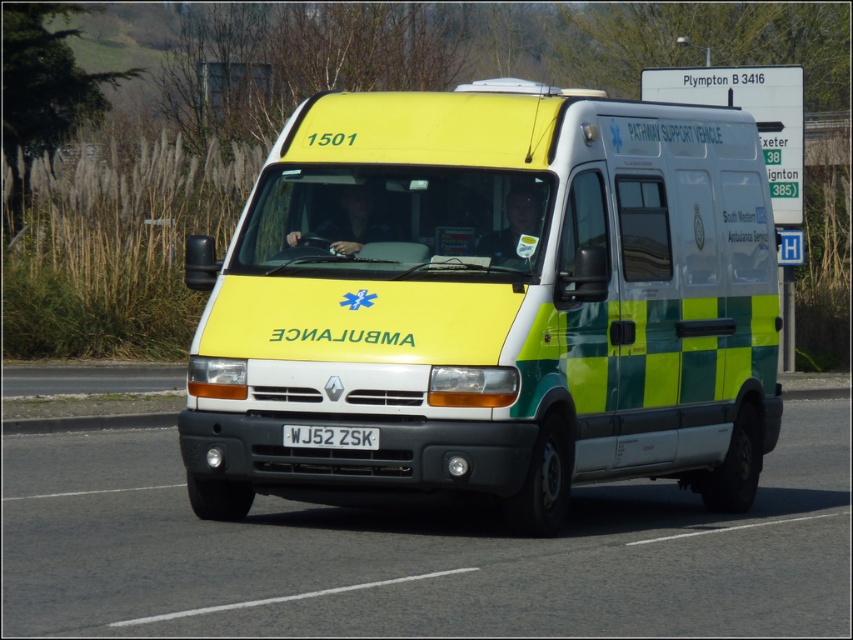
Is yellow/green checkered ambulance at center below yellow/green plastic van at center?

Actually, yellow/green checkered ambulance at center is above yellow/green plastic van at center.

Is yellow/green checkered ambulance at center behind yellow/green plastic van at center?

Yes, yellow/green checkered ambulance at center is further from the viewer.

Which is in front, point (453, 392) or point (642, 579)?

Point (642, 579) is more forward.

Locate an element on the screen. This screenshot has width=853, height=640. yellow/green checkered ambulance at center is located at coordinates (490, 304).

Does yellow/green plastic van at center have a lesser width compared to white plastic license plate at center?

No, yellow/green plastic van at center is not thinner than white plastic license plate at center.

Can you confirm if yellow/green plastic van at center is taller than white plastic license plate at center?

Correct, yellow/green plastic van at center is much taller as white plastic license plate at center.

At what (x,y) coordinates should I click in order to perform the action: click on yellow/green plastic van at center. Please return your answer as a coordinate pair (x, y). This screenshot has width=853, height=640. Looking at the image, I should click on (418, 554).

Is yellow/green checkered ambulance at center shorter than white plastic license plate at center?

Incorrect, yellow/green checkered ambulance at center's height does not fall short of white plastic license plate at center's.

Is yellow/green checkered ambulance at center closer to camera compared to white plastic license plate at center?

That is True.

Who is more distant from viewer, (531, 376) or (345, 442)?

Positioned behind is point (531, 376).

Identify the location of yellow/green checkered ambulance at center. This screenshot has height=640, width=853. (490, 304).